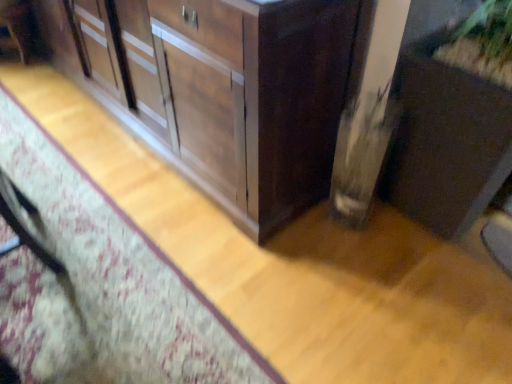
At what (x,y) coordinates should I click in order to perform the action: click on wooden cabinet at center, marked as the second cabinetry in a right-to-left arrangement. Please return your answer as a coordinate pair (x, y). This screenshot has height=384, width=512. Looking at the image, I should click on (221, 89).

What do you see at coordinates (221, 89) in the screenshot? This screenshot has width=512, height=384. I see `wooden cabinet at center, marked as the second cabinetry in a right-to-left arrangement` at bounding box center [221, 89].

The width and height of the screenshot is (512, 384). Describe the element at coordinates (446, 141) in the screenshot. I see `matte brown cabinet at lower right, the 2th cabinetry viewed from the left` at that location.

At what (x,y) coordinates should I click in order to perform the action: click on matte brown cabinet at lower right, placed as the 1th cabinetry when sorted from right to left. Please return your answer as a coordinate pair (x, y). The height and width of the screenshot is (384, 512). Looking at the image, I should click on (446, 141).

Where is `wooden cabinet at center, marked as the second cabinetry in a right-to-left arrangement`? wooden cabinet at center, marked as the second cabinetry in a right-to-left arrangement is located at coordinates (221, 89).

Between wooden cabinet at center, which ranks as the 1th cabinetry in left-to-right order, and matte brown cabinet at lower right, the 2th cabinetry viewed from the left, which one appears on the left side from the viewer's perspective?

wooden cabinet at center, which ranks as the 1th cabinetry in left-to-right order.

Looking at this image, considering their positions, is wooden cabinet at center, which ranks as the 1th cabinetry in left-to-right order, located in front of or behind matte brown cabinet at lower right, the 2th cabinetry viewed from the left?

wooden cabinet at center, which ranks as the 1th cabinetry in left-to-right order, is positioned farther from the viewer than matte brown cabinet at lower right, the 2th cabinetry viewed from the left.

Which is closer, (241, 68) or (453, 67)?

Point (241, 68) appears to be closer to the viewer than point (453, 67).

From the image's perspective, who appears lower, wooden cabinet at center, which ranks as the 1th cabinetry in left-to-right order, or matte brown cabinet at lower right, the 2th cabinetry viewed from the left?

matte brown cabinet at lower right, the 2th cabinetry viewed from the left.

From a real-world perspective, is wooden cabinet at center, marked as the second cabinetry in a right-to-left arrangement, located higher than matte brown cabinet at lower right, placed as the 1th cabinetry when sorted from right to left?

Yes, from a real-world perspective, wooden cabinet at center, marked as the second cabinetry in a right-to-left arrangement, is on top of matte brown cabinet at lower right, placed as the 1th cabinetry when sorted from right to left.

Which of these two, wooden cabinet at center, marked as the second cabinetry in a right-to-left arrangement, or matte brown cabinet at lower right, placed as the 1th cabinetry when sorted from right to left, is thinner?

Thinner between the two is matte brown cabinet at lower right, placed as the 1th cabinetry when sorted from right to left.

Between wooden cabinet at center, which ranks as the 1th cabinetry in left-to-right order, and matte brown cabinet at lower right, placed as the 1th cabinetry when sorted from right to left, which one has more height?

With more height is matte brown cabinet at lower right, placed as the 1th cabinetry when sorted from right to left.

Can you confirm if wooden cabinet at center, which ranks as the 1th cabinetry in left-to-right order, is smaller than matte brown cabinet at lower right, placed as the 1th cabinetry when sorted from right to left?

No.

Is wooden cabinet at center, marked as the second cabinetry in a right-to-left arrangement, completely or partially outside of matte brown cabinet at lower right, placed as the 1th cabinetry when sorted from right to left?

Yes.

Is the surface of wooden cabinet at center, which ranks as the 1th cabinetry in left-to-right order, in direct contact with matte brown cabinet at lower right, the 2th cabinetry viewed from the left?

No, wooden cabinet at center, which ranks as the 1th cabinetry in left-to-right order, is not next to matte brown cabinet at lower right, the 2th cabinetry viewed from the left.

Is wooden cabinet at center, marked as the second cabinetry in a right-to-left arrangement, oriented towards matte brown cabinet at lower right, the 2th cabinetry viewed from the left?

No.

What's the angular difference between wooden cabinet at center, which ranks as the 1th cabinetry in left-to-right order, and matte brown cabinet at lower right, the 2th cabinetry viewed from the left,'s facing directions?

The angle between the facing direction of wooden cabinet at center, which ranks as the 1th cabinetry in left-to-right order, and the facing direction of matte brown cabinet at lower right, the 2th cabinetry viewed from the left, is 89.1 degrees.

At what (x,y) coordinates should I click in order to perform the action: click on cabinetry below the wooden cabinet at center, which ranks as the 1th cabinetry in left-to-right order (from the image's perspective). Please return your answer as a coordinate pair (x, y). Image resolution: width=512 pixels, height=384 pixels. Looking at the image, I should click on (446, 141).

Which is more to the right, matte brown cabinet at lower right, the 2th cabinetry viewed from the left, or wooden cabinet at center, marked as the second cabinetry in a right-to-left arrangement?

From the viewer's perspective, matte brown cabinet at lower right, the 2th cabinetry viewed from the left, appears more on the right side.

Relative to wooden cabinet at center, marked as the second cabinetry in a right-to-left arrangement, is matte brown cabinet at lower right, the 2th cabinetry viewed from the left, in front or behind?

In the image, matte brown cabinet at lower right, the 2th cabinetry viewed from the left, appears in front of wooden cabinet at center, marked as the second cabinetry in a right-to-left arrangement.

Considering the points (387, 178) and (264, 148), which point is behind, point (387, 178) or point (264, 148)?

The point (387, 178) is farther.

From the image's perspective, would you say matte brown cabinet at lower right, placed as the 1th cabinetry when sorted from right to left, is shown under wooden cabinet at center, marked as the second cabinetry in a right-to-left arrangement?

Correct, matte brown cabinet at lower right, placed as the 1th cabinetry when sorted from right to left, appears lower than wooden cabinet at center, marked as the second cabinetry in a right-to-left arrangement, in the image.

From a real-world perspective, between matte brown cabinet at lower right, the 2th cabinetry viewed from the left, and wooden cabinet at center, which ranks as the 1th cabinetry in left-to-right order, who is vertically lower?

In real-world perspective, matte brown cabinet at lower right, the 2th cabinetry viewed from the left, is lower.

Considering the relative sizes of matte brown cabinet at lower right, the 2th cabinetry viewed from the left, and wooden cabinet at center, which ranks as the 1th cabinetry in left-to-right order, in the image provided, is matte brown cabinet at lower right, the 2th cabinetry viewed from the left, wider than wooden cabinet at center, which ranks as the 1th cabinetry in left-to-right order,?

Incorrect, the width of matte brown cabinet at lower right, the 2th cabinetry viewed from the left, does not surpass that of wooden cabinet at center, which ranks as the 1th cabinetry in left-to-right order.

Considering the relative sizes of matte brown cabinet at lower right, the 2th cabinetry viewed from the left, and wooden cabinet at center, which ranks as the 1th cabinetry in left-to-right order, in the image provided, is matte brown cabinet at lower right, the 2th cabinetry viewed from the left, shorter than wooden cabinet at center, which ranks as the 1th cabinetry in left-to-right order,?

No, matte brown cabinet at lower right, the 2th cabinetry viewed from the left, is not shorter than wooden cabinet at center, which ranks as the 1th cabinetry in left-to-right order.

Looking at this image, considering the relative sizes of matte brown cabinet at lower right, the 2th cabinetry viewed from the left, and wooden cabinet at center, marked as the second cabinetry in a right-to-left arrangement, in the image provided, is matte brown cabinet at lower right, the 2th cabinetry viewed from the left, smaller than wooden cabinet at center, marked as the second cabinetry in a right-to-left arrangement,?

Indeed, matte brown cabinet at lower right, the 2th cabinetry viewed from the left, has a smaller size compared to wooden cabinet at center, marked as the second cabinetry in a right-to-left arrangement.

Is matte brown cabinet at lower right, placed as the 1th cabinetry when sorted from right to left, inside or outside of wooden cabinet at center, marked as the second cabinetry in a right-to-left arrangement?

matte brown cabinet at lower right, placed as the 1th cabinetry when sorted from right to left, lies outside wooden cabinet at center, marked as the second cabinetry in a right-to-left arrangement.

Is the surface of matte brown cabinet at lower right, placed as the 1th cabinetry when sorted from right to left, in direct contact with wooden cabinet at center, marked as the second cabinetry in a right-to-left arrangement?

No, matte brown cabinet at lower right, placed as the 1th cabinetry when sorted from right to left, is not next to wooden cabinet at center, marked as the second cabinetry in a right-to-left arrangement.

Could you tell me if matte brown cabinet at lower right, placed as the 1th cabinetry when sorted from right to left, is turned towards wooden cabinet at center, which ranks as the 1th cabinetry in left-to-right order?

No, matte brown cabinet at lower right, placed as the 1th cabinetry when sorted from right to left, is not oriented towards wooden cabinet at center, which ranks as the 1th cabinetry in left-to-right order.

How different are the orientations of matte brown cabinet at lower right, placed as the 1th cabinetry when sorted from right to left, and wooden cabinet at center, marked as the second cabinetry in a right-to-left arrangement, in degrees?

89.1 degrees.

The width and height of the screenshot is (512, 384). I want to click on cabinetry on the right side of wooden cabinet at center, marked as the second cabinetry in a right-to-left arrangement, so click(x=446, y=141).

Find the location of a particular element. The image size is (512, 384). cabinetry above the matte brown cabinet at lower right, the 2th cabinetry viewed from the left (from a real-world perspective) is located at coordinates (221, 89).

The width and height of the screenshot is (512, 384). In order to click on cabinetry in front of the wooden cabinet at center, marked as the second cabinetry in a right-to-left arrangement in this screenshot , I will do `click(446, 141)`.